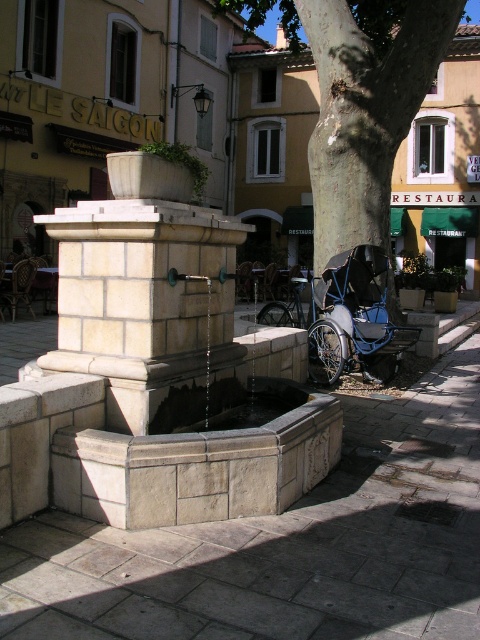
Is point (359, 202) positioned in front of point (347, 360)?

No, (359, 202) is further to viewer.

Is smooth bark tree at center to the right of blue metallic baby carriage at center from the viewer's perspective?

Correct, you'll find smooth bark tree at center to the right of blue metallic baby carriage at center.

Is point (349, 17) positioned in front of point (355, 355)?

No.

Where is `smooth bark tree at center`? smooth bark tree at center is located at coordinates (360, 99).

Does stone pavement at center have a greater height compared to blue metallic baby carriage at center?

Incorrect, stone pavement at center's height is not larger of blue metallic baby carriage at center's.

Can you confirm if stone pavement at center is positioned below blue metallic baby carriage at center?

Indeed, stone pavement at center is positioned under blue metallic baby carriage at center.

The width and height of the screenshot is (480, 640). Find the location of `stone pavement at center`. stone pavement at center is located at coordinates (288, 544).

Can you confirm if white stone fountain at center is thinner than blue metallic baby carriage at center?

No.

Is point (176, 324) positioned behind point (348, 340)?

No, it is in front of (348, 340).

Who is more forward, (103, 477) or (383, 284)?

Positioned in front is point (103, 477).

Where is `white stone fountain at center`? The height and width of the screenshot is (640, 480). white stone fountain at center is located at coordinates (169, 365).